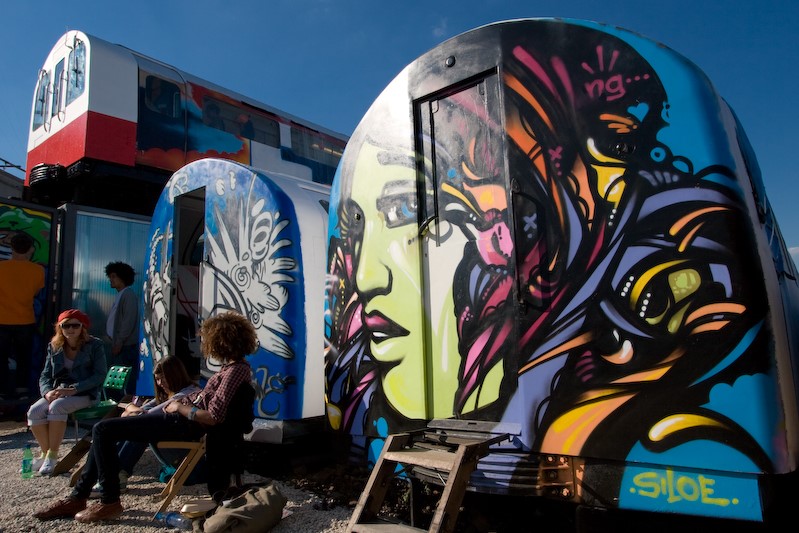
You are a GUI agent. You are given a task and a screenshot of the screen. Output one action in this format:
    pyautogui.click(x=<x>, y=<y>)
    Task: Click on the wood chair
    The height and width of the screenshot is (533, 799).
    Given the screenshot: What is the action you would take?
    pyautogui.click(x=185, y=444)